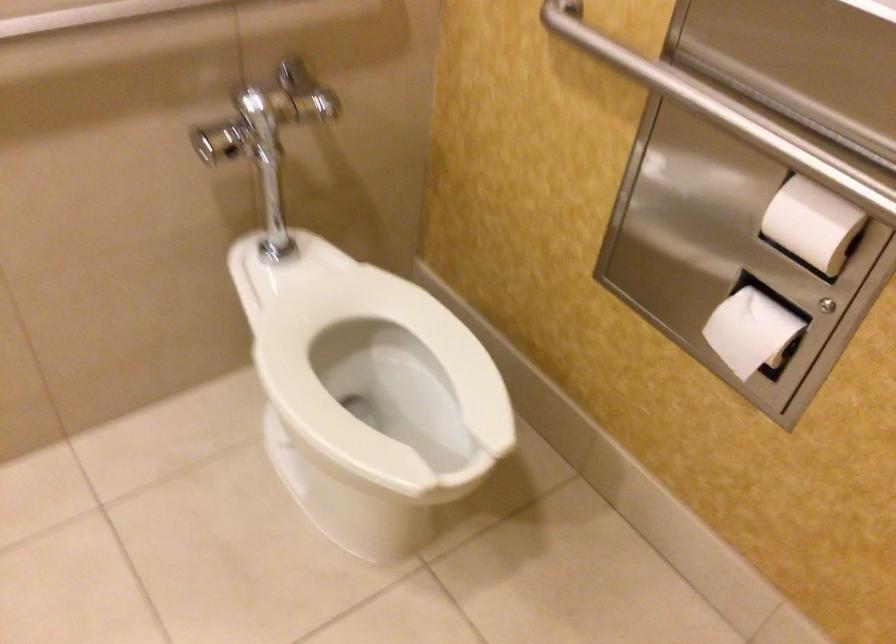
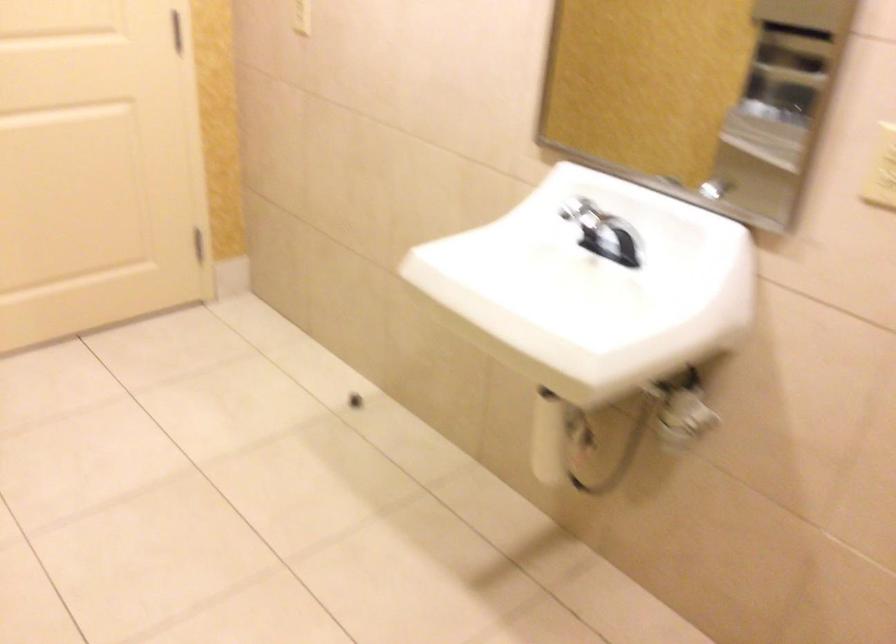
Question: Based on the continuous images, in which direction is the camera rotating? Reply with the corresponding letter.

Choices:
 (A) Left
 (B) Right
 (C) Up
 (D) Down

Answer: (A)